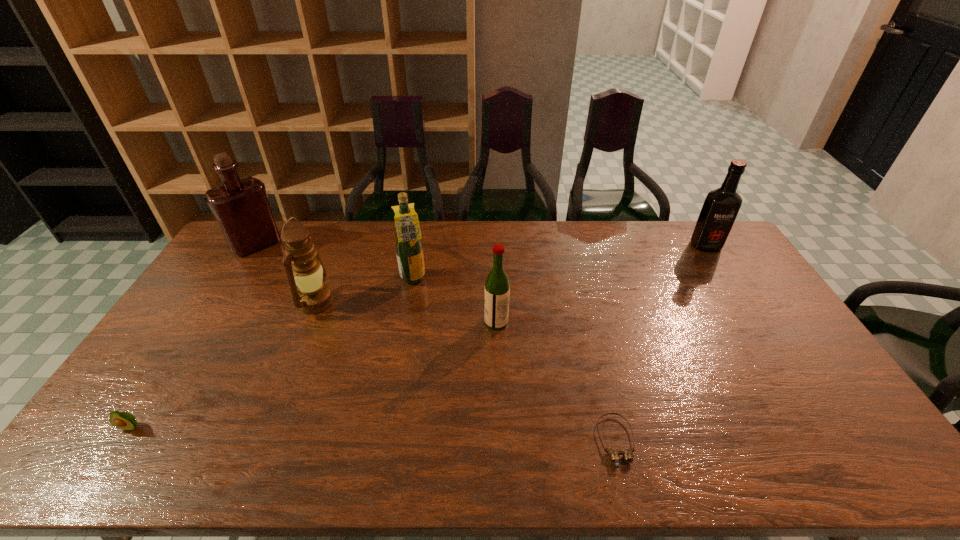
You are a GUI agent. You are given a task and a screenshot of the screen. Output one action in this format:
    pyautogui.click(x=<x>, y=<y>)
    Task: Click on the free region located 0.170m on the right of the leftmost liquor
    The width and height of the screenshot is (960, 540).
    Given the screenshot: What is the action you would take?
    pyautogui.click(x=324, y=245)

Locate an element on the screen. The width and height of the screenshot is (960, 540). free spot located 0.130m on the front-facing side of the rightmost liquor is located at coordinates pos(725,275).

Where is `vacant space located 0.190m on the front-facing side of the second liquor from left to right`? This screenshot has width=960, height=540. vacant space located 0.190m on the front-facing side of the second liquor from left to right is located at coordinates (482, 280).

Locate an element on the screen. free space located 0.240m on the right of the fifth object from right to left is located at coordinates (406, 302).

Image resolution: width=960 pixels, height=540 pixels. Identify the location of vacant point located 0.340m on the label of the third object from right to left. (376, 322).

Find the location of a particular element. The image size is (960, 540). free space located 0.350m on the label of the third object from right to left is located at coordinates (373, 322).

What are the coordinates of `free space located on the label of the third object from right to left` in the screenshot? It's located at (444, 322).

Where is `blank space located 0.100m on the cut side of the second shortest object`? The width and height of the screenshot is (960, 540). blank space located 0.100m on the cut side of the second shortest object is located at coordinates (100, 473).

Find the location of `object situated at the near edge`. object situated at the near edge is located at coordinates click(x=614, y=454).

Identify the location of liquor that is at the left edge. (241, 207).